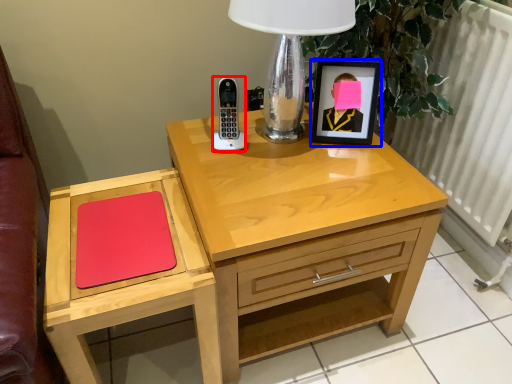
Question: Among these objects, which one is nearest to the camera, control (highlighted by a red box) or picture frame (highlighted by a blue box)?

Choices:
 (A) control
 (B) picture frame

Answer: (A)